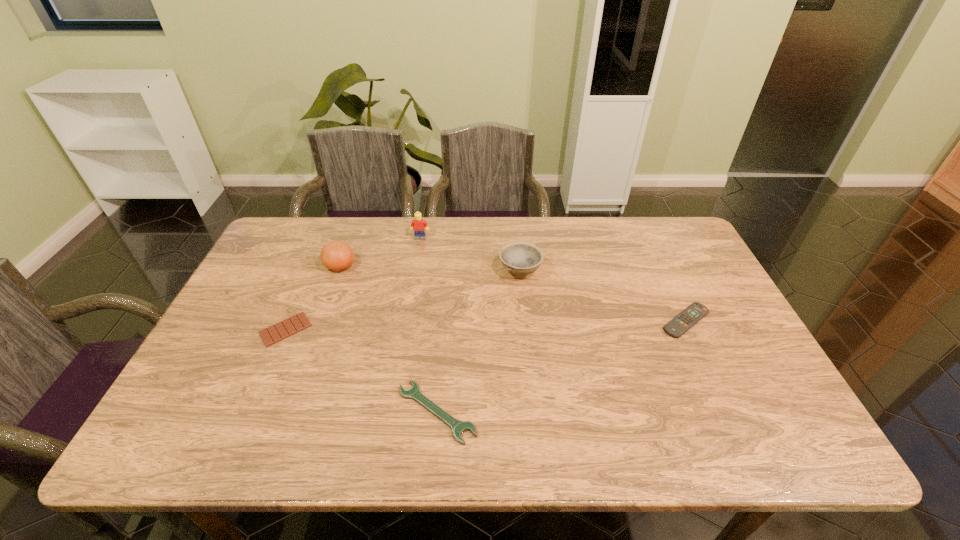
This screenshot has height=540, width=960. Identify the location of object that is at the left edge. (294, 324).

I want to click on object that is at the right edge, so click(x=680, y=324).

Where is `vacant space at the far edge`? vacant space at the far edge is located at coordinates point(534,242).

This screenshot has height=540, width=960. I want to click on vacant area at the near edge, so click(x=642, y=431).

Identify the location of vacant space at the left edge of the desktop. [x=246, y=296].

Locate an element on the screen. This screenshot has width=960, height=540. free space at the far right corner of the desktop is located at coordinates (662, 248).

The image size is (960, 540). What are the coordinates of `vacant space at the near right corner of the desktop` in the screenshot? It's located at (730, 432).

Where is `free space between the Lego and the third shortest object`? This screenshot has height=540, width=960. free space between the Lego and the third shortest object is located at coordinates (553, 279).

Image resolution: width=960 pixels, height=540 pixels. I want to click on vacant region between the candy bar and the remote control, so click(486, 325).

Find the location of a particular element. Image resolution: width=960 pixels, height=540 pixels. vacant area between the Lego and the clementine is located at coordinates (380, 252).